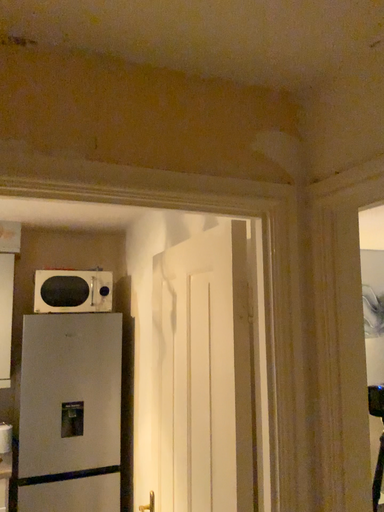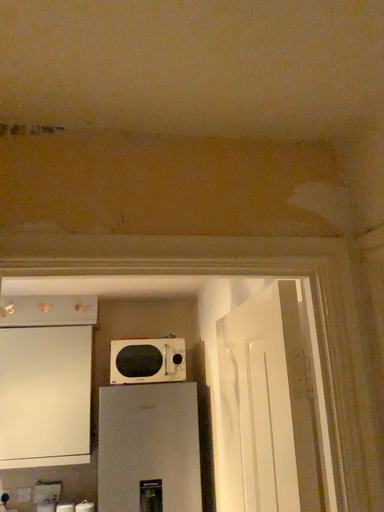
Question: Which way did the camera rotate in the video?

Choices:
 (A) rotated left
 (B) rotated right

Answer: (A)